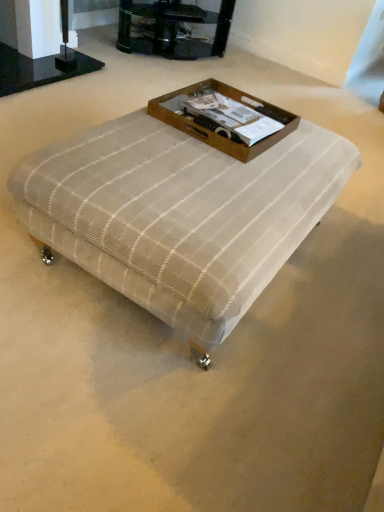
Question: Should I look upward or downward to see brown wooden tray at center?

Choices:
 (A) up
 (B) down

Answer: (A)

Question: From the image's perspective, is plaid fabric ottoman at center over brown wooden tray at center?

Choices:
 (A) yes
 (B) no

Answer: (B)

Question: Is plaid fabric ottoman at center shorter than brown wooden tray at center?

Choices:
 (A) no
 (B) yes

Answer: (A)

Question: Is plaid fabric ottoman at center thinner than brown wooden tray at center?

Choices:
 (A) yes
 (B) no

Answer: (B)

Question: Does plaid fabric ottoman at center have a smaller size compared to brown wooden tray at center?

Choices:
 (A) no
 (B) yes

Answer: (A)

Question: Is the depth of plaid fabric ottoman at center greater than that of brown wooden tray at center?

Choices:
 (A) yes
 (B) no

Answer: (B)

Question: Considering the relative sizes of plaid fabric ottoman at center and brown wooden tray at center in the image provided, is plaid fabric ottoman at center taller than brown wooden tray at center?

Choices:
 (A) no
 (B) yes

Answer: (B)

Question: Does brown wooden tray at center contain plaid fabric ottoman at center?

Choices:
 (A) yes
 (B) no

Answer: (B)

Question: Could you tell me if brown wooden tray at center is facing plaid fabric ottoman at center?

Choices:
 (A) no
 (B) yes

Answer: (A)

Question: Is brown wooden tray at center closer to the viewer compared to plaid fabric ottoman at center?

Choices:
 (A) no
 (B) yes

Answer: (A)

Question: From a real-world perspective, is brown wooden tray at center on plaid fabric ottoman at center?

Choices:
 (A) no
 (B) yes

Answer: (B)

Question: Is brown wooden tray at center to the left of plaid fabric ottoman at center from the viewer's perspective?

Choices:
 (A) no
 (B) yes

Answer: (A)

Question: Can you confirm if brown wooden tray at center is taller than plaid fabric ottoman at center?

Choices:
 (A) no
 (B) yes

Answer: (A)

Question: Does plaid fabric ottoman at center touch clear glass tv stand at upper center?

Choices:
 (A) yes
 (B) no

Answer: (B)